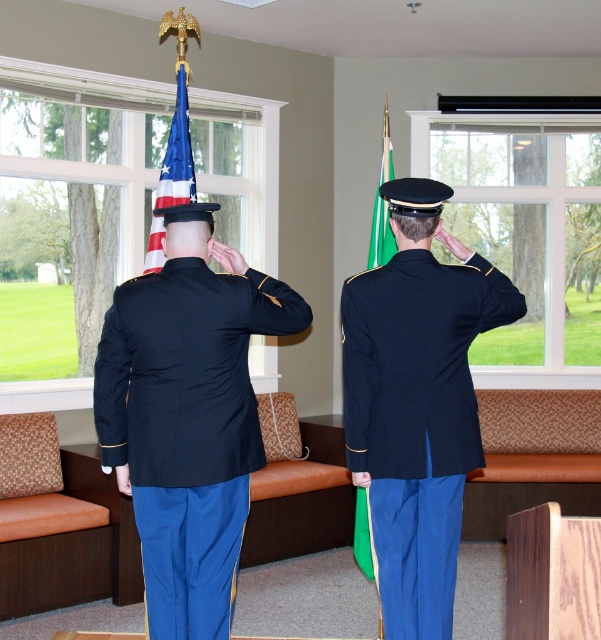
Between navy blue fabric jacket at center and matte black jacket at center, which one appears on the left side from the viewer's perspective?

matte black jacket at center is more to the left.

Is point (391, 403) behind point (135, 392)?

Yes, point (391, 403) is behind point (135, 392).

The width and height of the screenshot is (601, 640). I want to click on navy blue fabric jacket at center, so click(x=416, y=419).

How much distance is there between navy blue fabric jacket at center and american flag at center?

navy blue fabric jacket at center is 1.36 meters away from american flag at center.

Between navy blue fabric jacket at center and american flag at center, which one appears on the left side from the viewer's perspective?

american flag at center

Is point (385, 554) farther from viewer compared to point (178, 122)?

No, (385, 554) is closer to viewer.

You are a GUI agent. You are given a task and a screenshot of the screen. Output one action in this format:
    pyautogui.click(x=<x>, y=<y>)
    Task: Click on the navy blue fabric jacket at center
    This screenshot has width=601, height=640.
    Given the screenshot: What is the action you would take?
    pyautogui.click(x=416, y=419)

Between matte black jacket at center and american flag at center, which one appears on the right side from the viewer's perspective?

matte black jacket at center is more to the right.

Is point (227, 349) positioned behind point (175, 188)?

No.

At what (x,y) coordinates should I click in order to perform the action: click on matte black jacket at center. Please return your answer as a coordinate pair (x, y). Image resolution: width=601 pixels, height=640 pixels. Looking at the image, I should click on (185, 372).